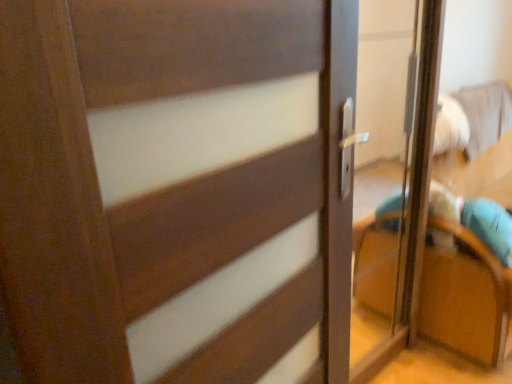
Question: Can you confirm if matte wood door at center is positioned to the left of teal fabric armchair at right?

Choices:
 (A) yes
 (B) no

Answer: (A)

Question: Does matte wood door at center have a lesser width compared to teal fabric armchair at right?

Choices:
 (A) yes
 (B) no

Answer: (A)

Question: Are matte wood door at center and teal fabric armchair at right far apart?

Choices:
 (A) no
 (B) yes

Answer: (B)

Question: From a real-world perspective, is matte wood door at center below teal fabric armchair at right?

Choices:
 (A) no
 (B) yes

Answer: (A)

Question: From the image's perspective, is matte wood door at center below teal fabric armchair at right?

Choices:
 (A) yes
 (B) no

Answer: (A)

Question: Could teal fabric armchair at right be considered to be inside matte wood door at center?

Choices:
 (A) yes
 (B) no

Answer: (B)

Question: Is teal fabric armchair at right with matte wood door at center?

Choices:
 (A) no
 (B) yes

Answer: (A)

Question: Can you confirm if teal fabric armchair at right is thinner than matte wood door at center?

Choices:
 (A) no
 (B) yes

Answer: (A)

Question: Is teal fabric armchair at right oriented away from matte wood door at center?

Choices:
 (A) yes
 (B) no

Answer: (B)

Question: Does teal fabric armchair at right have a greater height compared to matte wood door at center?

Choices:
 (A) yes
 (B) no

Answer: (B)

Question: From a real-world perspective, is teal fabric armchair at right located higher than matte wood door at center?

Choices:
 (A) no
 (B) yes

Answer: (A)

Question: Is matte wood door at center a part of teal fabric armchair at right?

Choices:
 (A) no
 (B) yes

Answer: (A)

Question: From the image's perspective, is teal fabric armchair at right positioned above or below matte wood door at center?

Choices:
 (A) below
 (B) above

Answer: (B)